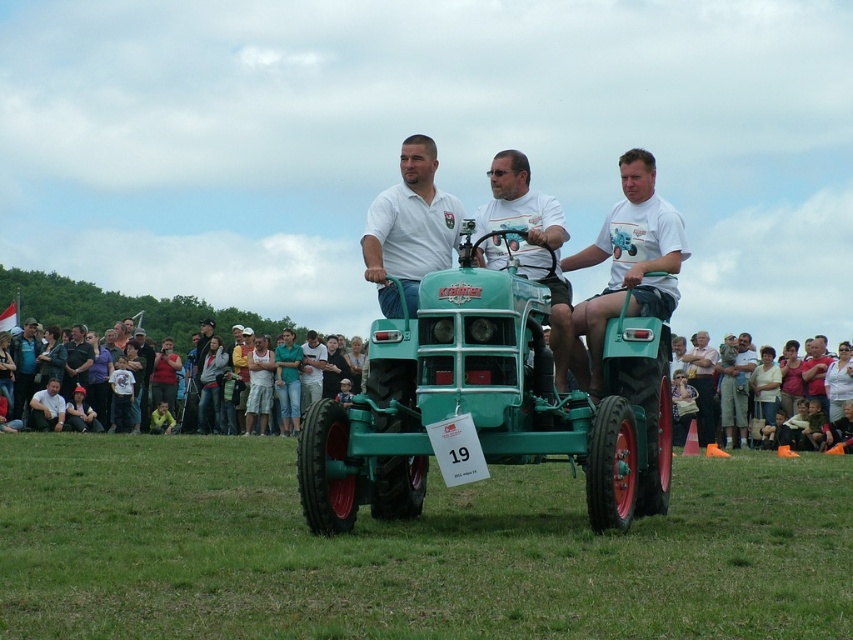
Does matte white shirt at center appear on the left side of matte green tractor at center?

Correct, you'll find matte white shirt at center to the left of matte green tractor at center.

Between matte white shirt at center and matte green tractor at center, which one appears on the right side from the viewer's perspective?

Positioned to the right is matte green tractor at center.

I want to click on matte white shirt at center, so click(x=409, y=228).

Locate an element on the screen. This screenshot has width=853, height=640. matte white shirt at center is located at coordinates (409, 228).

Is point (428, 138) behind point (76, 353)?

No, it is in front of (76, 353).

Consider the image. Who is more forward, (428,141) or (67,365)?

Positioned in front is point (428,141).

Identify the location of matte white shirt at center. Image resolution: width=853 pixels, height=640 pixels. (409, 228).

Is white cotton shirt at center wider than matte white shirt at center?

Correct, the width of white cotton shirt at center exceeds that of matte white shirt at center.

Is white cotton shirt at center to the left of matte white shirt at center from the viewer's perspective?

Indeed, white cotton shirt at center is positioned on the left side of matte white shirt at center.

Is point (318, 365) closer to camera compared to point (405, 298)?

No.

At what (x,y) coordinates should I click in order to perform the action: click on white cotton shirt at center. Please return your answer as a coordinate pair (x, y). Image resolution: width=853 pixels, height=640 pixels. Looking at the image, I should click on (270, 378).